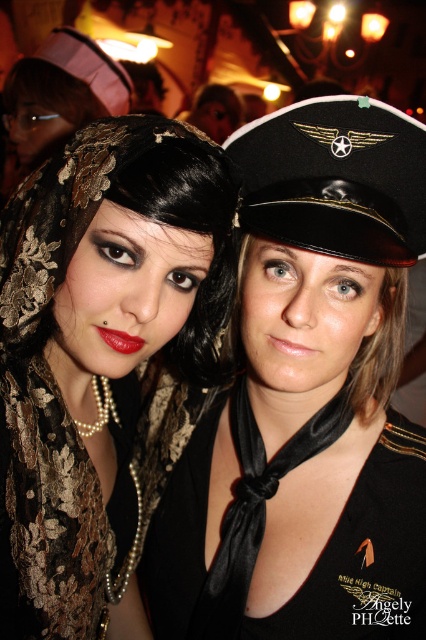
You are a photographer at a party and want to capture a closeup shot of both the black satin scarf at center and the black lace headscarf at upper left. The camera can only focus on objects within 5 inches of each other. Can you take a photo that includes both items in focus?

The black satin scarf at center is 5.89 inches from the black lace headscarf at upper left. Since the distance between them exceeds the camera focus range of 5 inches, the camera cannot focus on both items simultaneously.

You are a photographer at a party and want to ensure the black lace headscarf at upper left and the gold lace dress at center are both visible in your photo. Which object is covering part of the other?

The black lace headscarf at upper left is positioned over the gold lace dress at center, so it is covering part of the gold lace dress at center.